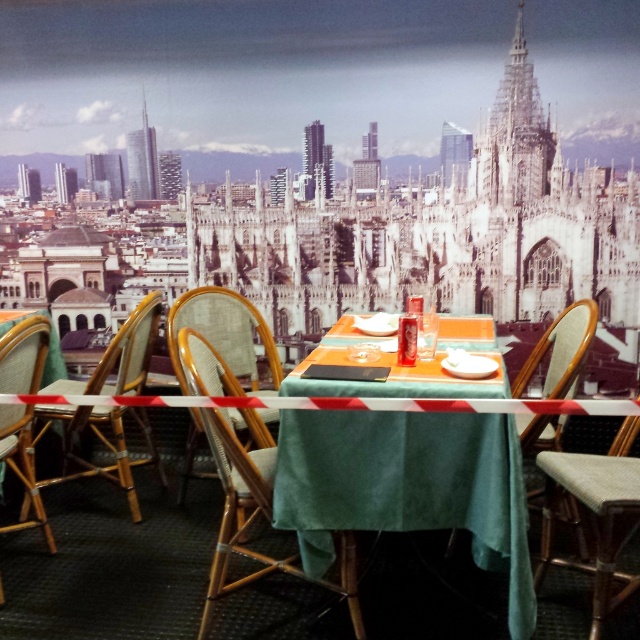
You are a guest at the restaurant and want to sit in the woven fabric chair at center. Where should you walk to find it?

The woven fabric chair at center is located at point [225,333].

You are a person who is 1.7 meters tall. You are sitting on the wooden chair at left and trying to reach the menu placed on the green velvet table at center. Considering the height difference between the two, can you comfortably reach the menu?

The green velvet table at center is much taller than the wooden chair at left. Since the table is significantly higher, you might have difficulty comfortably reaching the menu placed on it while sitting on the lower chair.